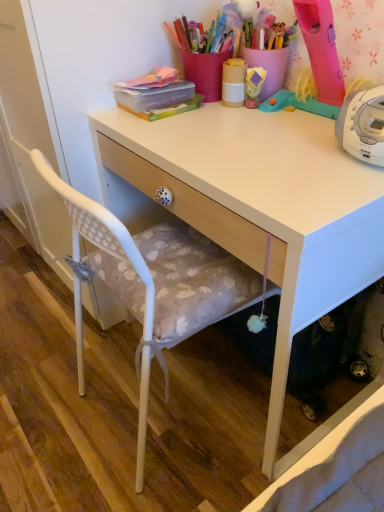
You are a GUI agent. You are given a task and a screenshot of the screen. Output one action in this format:
    pyautogui.click(x=<x>, y=<y>)
    Task: Click on the free point above white matte desk at center (from a real-world perspective)
    The height and width of the screenshot is (512, 384).
    Given the screenshot: What is the action you would take?
    pyautogui.click(x=245, y=133)